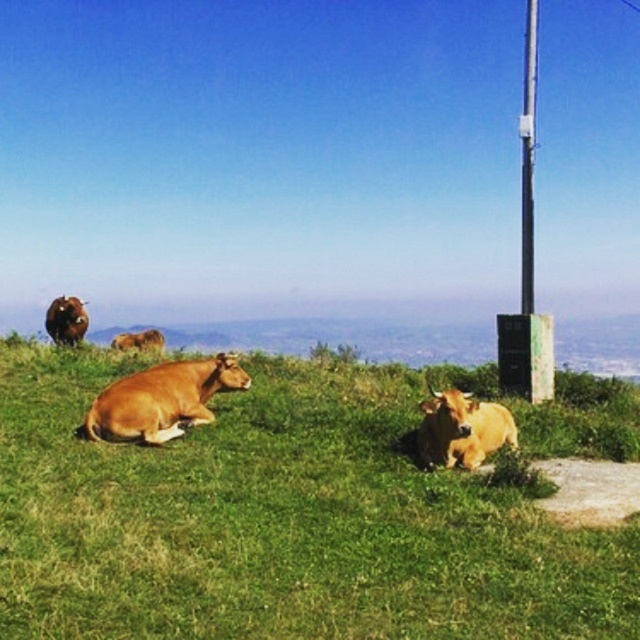
Is brown smooth cow at lower left to the left of metallic pole at right from the viewer's perspective?

Indeed, brown smooth cow at lower left is positioned on the left side of metallic pole at right.

Between brown smooth cow at lower left and metallic pole at right, which one has less height?

brown smooth cow at lower left

Locate an element on the screen. brown smooth cow at lower left is located at coordinates (163, 400).

Is metallic pole at right below brown smooth cow at upper left?

Incorrect, metallic pole at right is not positioned below brown smooth cow at upper left.

Is metallic pole at right behind brown smooth cow at upper left?

No, metallic pole at right is in front of brown smooth cow at upper left.

Is point (536, 88) more distant than point (116, 333)?

Yes, point (536, 88) is behind point (116, 333).

You are a GUI agent. You are given a task and a screenshot of the screen. Output one action in this format:
    pyautogui.click(x=<x>, y=<y>)
    Task: Click on the metallic pole at right
    The height and width of the screenshot is (640, 640).
    Given the screenshot: What is the action you would take?
    pyautogui.click(x=528, y=157)

Can you confirm if brown furry bull at lower left is positioned to the left of brown smooth cow at upper left?

No, brown furry bull at lower left is not to the left of brown smooth cow at upper left.

Identify the location of brown furry bull at lower left. (67, 321).